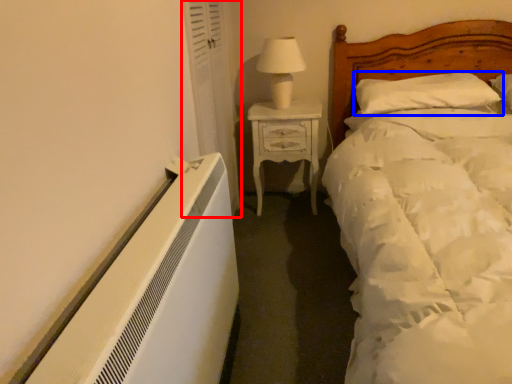
Question: Among these objects, which one is farthest to the camera, curtain (highlighted by a red box) or pillow (highlighted by a blue box)?

Choices:
 (A) curtain
 (B) pillow

Answer: (B)